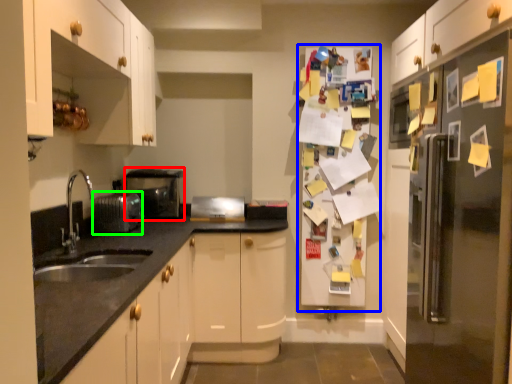
Question: Estimate the real-world distances between objects in this image. Which object is closer to appliance (highlighted by a red box), fridge (highlighted by a blue box) or appliance (highlighted by a green box)?

Choices:
 (A) fridge
 (B) appliance

Answer: (B)